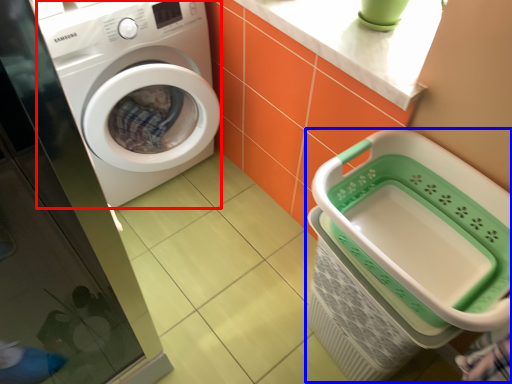
Question: Which object is further to the camera taking this photo, washing machine (highlighted by a red box) or shopping basket (highlighted by a blue box)?

Choices:
 (A) washing machine
 (B) shopping basket

Answer: (A)